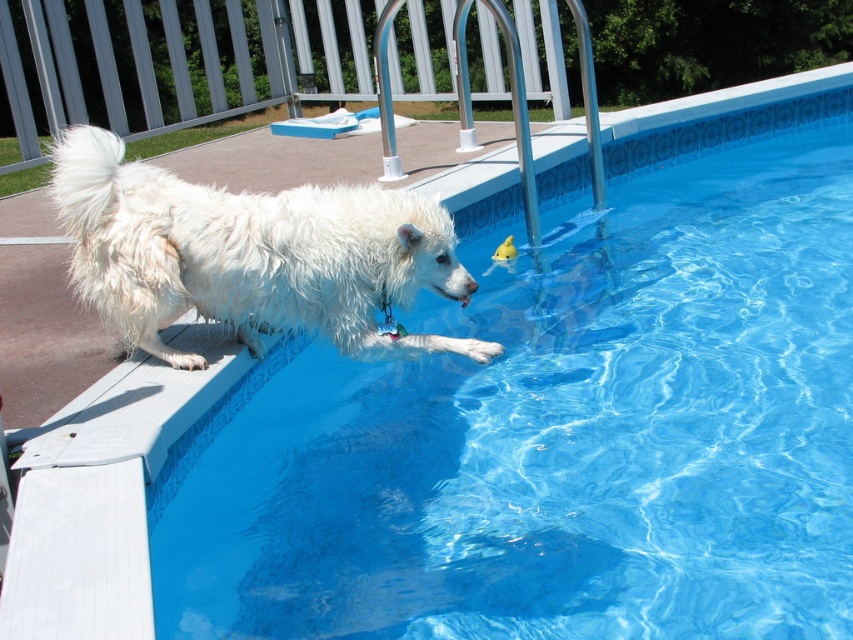
You are a guest at this poolside area and want to walk from the white fluffy dog at left to the blue tile swimming pool at upper center. Which direction should you move relative to the dog?

You should move to the right relative to the white fluffy dog at left to reach the blue tile swimming pool at upper center, as the pool is located to the right of the dog according to the scene description.

You are a guest at this pool area and want to know if the blue tile swimming pool at upper center can accommodate both you and the white fluffy dog at left comfortably. Can you determine based on their sizes?

The blue tile swimming pool at upper center is bigger than the white fluffy dog at left, so there should be enough space for both you and the white fluffy dog at left to be comfortable.

You are standing at the edge of the residential pool area and see the point marked at coordinates (561,424). Where is this point located in relation to the blue tile swimming pool at upper center?

The point marked at coordinates (561,424) is located on the blue tile swimming pool at upper center.